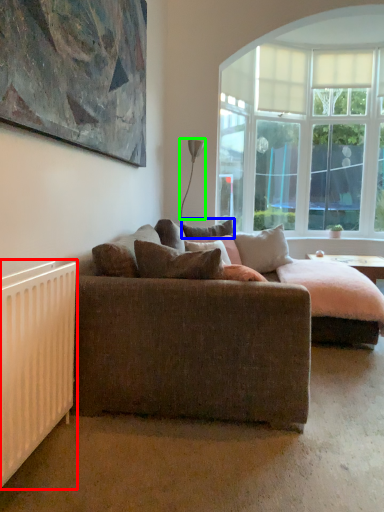
Question: Estimate the real-world distances between objects in this image. Which object is closer to radiator (highlighted by a red box), pillow (highlighted by a blue box) or lamp (highlighted by a green box)?

Choices:
 (A) pillow
 (B) lamp

Answer: (A)